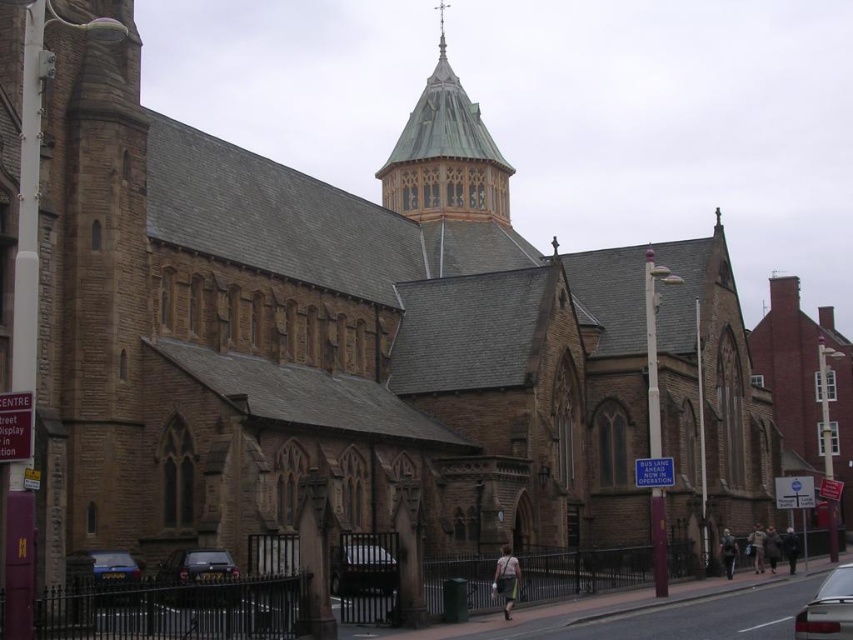
Can you confirm if green copper roof at upper center is positioned below metallic silver car at lower left?

Actually, green copper roof at upper center is above metallic silver car at lower left.

The height and width of the screenshot is (640, 853). What do you see at coordinates (445, 156) in the screenshot?
I see `green copper roof at upper center` at bounding box center [445, 156].

Locate an element on the screen. The image size is (853, 640). green copper roof at upper center is located at coordinates (445, 156).

Looking at this image, does metallic silver car at lower right have a lesser width compared to metallic silver car at center?

No, metallic silver car at lower right is not thinner than metallic silver car at center.

Between metallic silver car at lower right and metallic silver car at center, which one has less height?

With less height is metallic silver car at center.

Find the location of a particular element. This screenshot has width=853, height=640. metallic silver car at lower right is located at coordinates (828, 609).

Is green copper roof at upper center to the right of metallic silver car at center from the viewer's perspective?

Correct, you'll find green copper roof at upper center to the right of metallic silver car at center.

What do you see at coordinates (445, 156) in the screenshot? Image resolution: width=853 pixels, height=640 pixels. I see `green copper roof at upper center` at bounding box center [445, 156].

Image resolution: width=853 pixels, height=640 pixels. In order to click on green copper roof at upper center in this screenshot , I will do `click(445, 156)`.